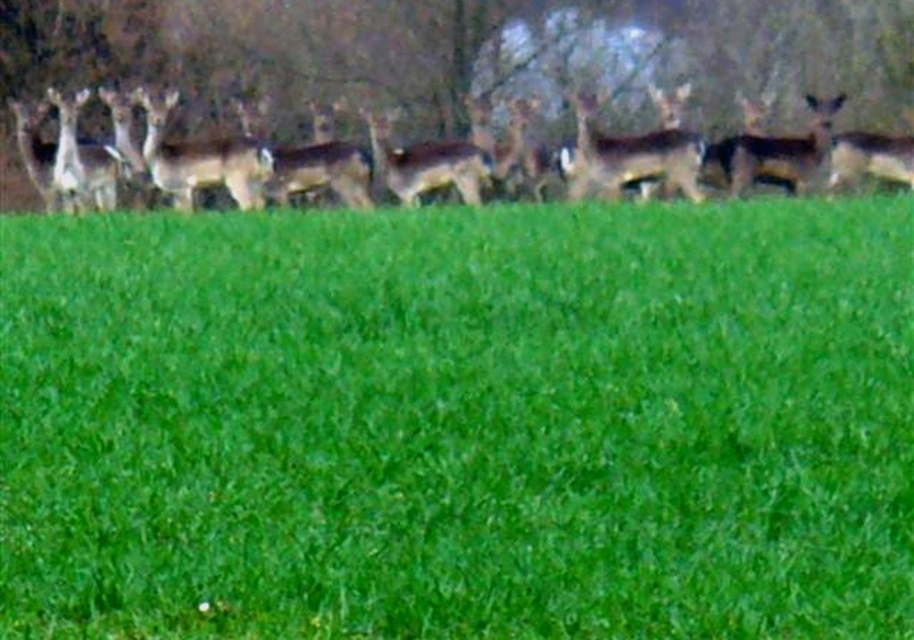
Which is above, brown fur deer at center or brown matte deer at upper right?

brown matte deer at upper right is above.

Is brown fur deer at center thinner than brown matte deer at upper right?

In fact, brown fur deer at center might be wider than brown matte deer at upper right.

The width and height of the screenshot is (914, 640). Describe the element at coordinates (200, 157) in the screenshot. I see `brown fur deer at center` at that location.

The height and width of the screenshot is (640, 914). I want to click on brown fur deer at center, so click(200, 157).

Does brown matte deer at upper center appear on the left side of brown matte deer at center?

Correct, you'll find brown matte deer at upper center to the left of brown matte deer at center.

Is brown matte deer at upper center below brown matte deer at center?

No, brown matte deer at upper center is not below brown matte deer at center.

Locate an element on the screen. brown matte deer at upper center is located at coordinates (875, 154).

Looking at this image, is green grass at lower center bigger than brown matte deer at upper center?

No, green grass at lower center is not bigger than brown matte deer at upper center.

Who is shorter, green grass at lower center or brown matte deer at upper center?

green grass at lower center is shorter.

Which is behind, point (309, 388) or point (728, 177)?

The point (728, 177) is more distant.

Identify the location of green grass at lower center. The height and width of the screenshot is (640, 914). 459,422.